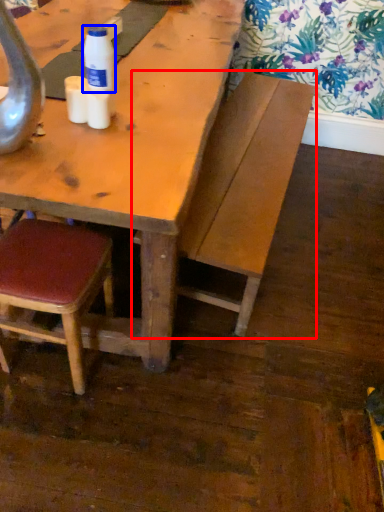
Question: Which of the following is the closest to the observer, bench (highlighted by a red box) or bottle (highlighted by a blue box)?

Choices:
 (A) bench
 (B) bottle

Answer: (B)